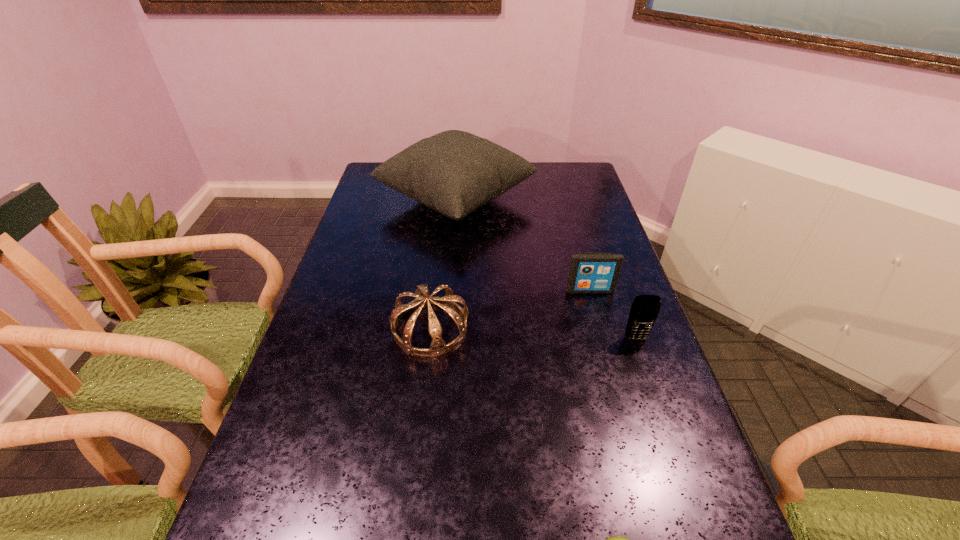
In order to click on object situated at the left edge in this screenshot , I will do `click(454, 172)`.

The image size is (960, 540). Find the location of `cellular telephone that is at the right edge`. cellular telephone that is at the right edge is located at coordinates (644, 311).

Find the location of `iPod at the right edge`. iPod at the right edge is located at coordinates (589, 272).

Identify the location of object at the far left corner. coord(454,172).

Identify the location of free point at the left edge. (388, 205).

You are a GUI agent. You are given a task and a screenshot of the screen. Output one action in this format:
    pyautogui.click(x=<x>, y=<y>)
    Task: Click on the free region at the right edge
    
    Given the screenshot: What is the action you would take?
    point(607,248)

At what (x,y) coordinates should I click in order to perform the action: click on free spot between the second farthest object and the cellular telephone. Please return your answer as a coordinate pair (x, y). Looking at the image, I should click on (612, 314).

You are a GUI agent. You are given a task and a screenshot of the screen. Output one action in this format:
    pyautogui.click(x=<x>, y=<y>)
    Task: Click on the free space between the cushion and the tiara
    
    Given the screenshot: What is the action you would take?
    pyautogui.click(x=444, y=264)

Where is `free area in between the tiara and the cellular telephone`? The image size is (960, 540). free area in between the tiara and the cellular telephone is located at coordinates (533, 333).

Where is `free spot between the iPod and the tiara`? This screenshot has width=960, height=540. free spot between the iPod and the tiara is located at coordinates (510, 309).